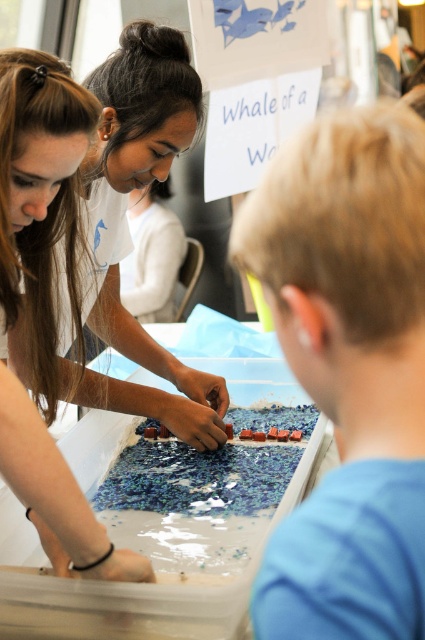
Is blue matte puzzle pieces at right to the left of matte white shirt at upper left from the viewer's perspective?

Incorrect, blue matte puzzle pieces at right is not on the left side of matte white shirt at upper left.

Measure the distance between blue matte puzzle pieces at right and matte white shirt at upper left.

blue matte puzzle pieces at right and matte white shirt at upper left are 27.47 inches apart from each other.

Who is more forward, (350, 220) or (87, 400)?

Point (350, 220)

Find the location of a particular element. blue matte puzzle pieces at right is located at coordinates (348, 369).